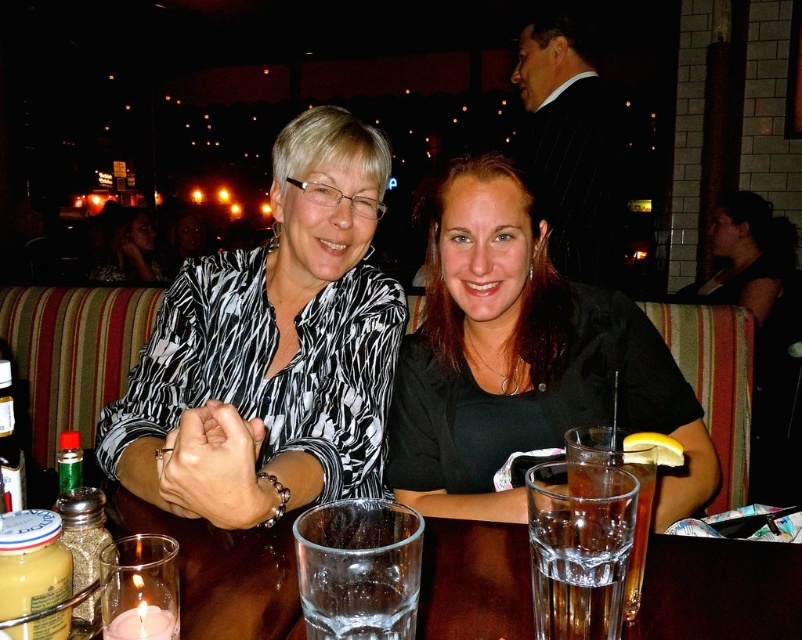
What is located at the coordinates point [270,349] in the image?

The point [270,349] corresponds to the printed fabric blouse at center.